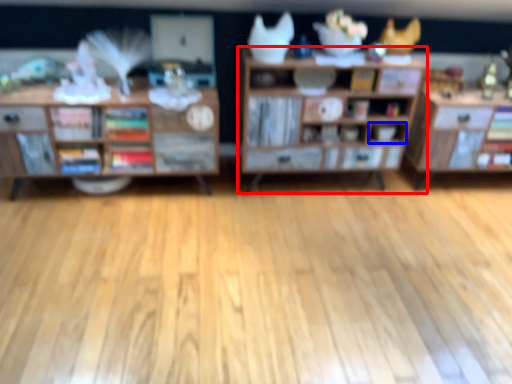
Question: Among these objects, which one is farthest to the camera, shelf (highlighted by a red box) or cabinet (highlighted by a blue box)?

Choices:
 (A) shelf
 (B) cabinet

Answer: (B)